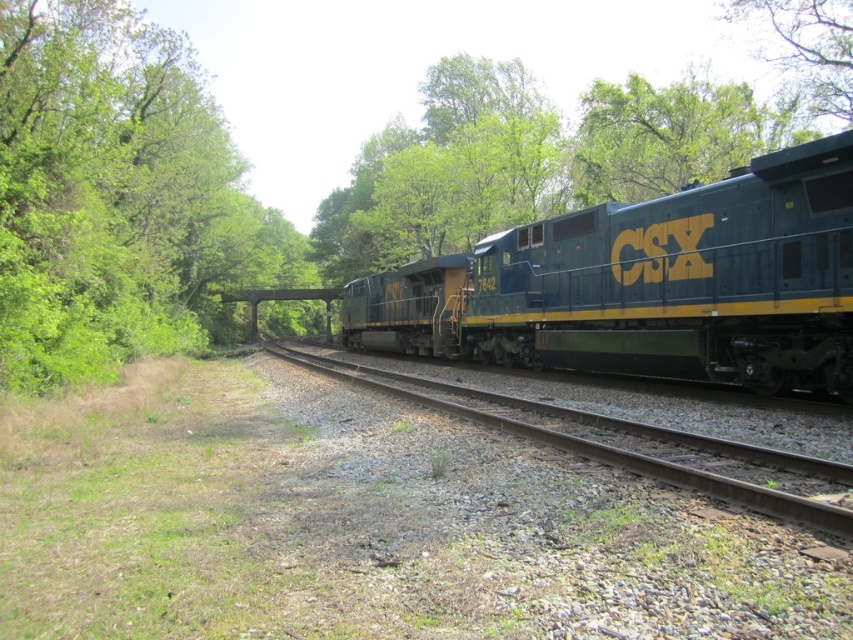
You are a railway engineer inspecting the tracks. You notice the green metallic track at center and the green leafy tree at upper right. Which object is located to the left of the other?

The green metallic track at center is positioned on the left side of green leafy tree at upper right.

You are a photographer standing at the center of the scene. You want to capture a photo of the green matte train at center and the green metallic track at center. Based on their positions, which object is positioned to the right side of the other?

The green matte train at center is to the right of the green metallic track at center.

You are a railway inspector checking the track conditions. You notice the green metallic track at center and the green leafy tree at upper right. Which one has a smaller width?

The green metallic track at center has a smaller width than the green leafy tree at upper right.